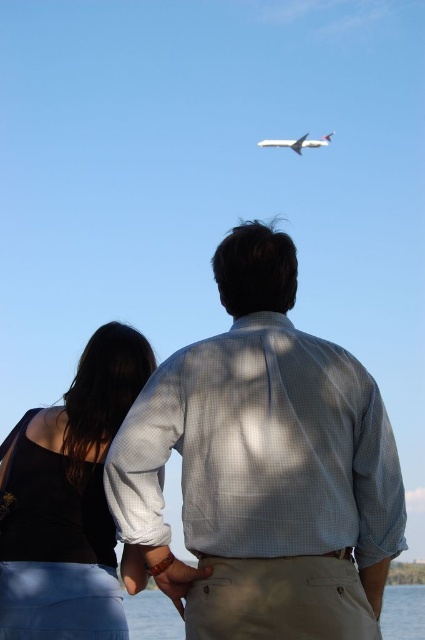
You are a photographer trying to capture a closeup shot of both the white checkered shirt at center and the matte khaki pants at lower center. Given that your camera has a maximum focus range of 8 meters, will you be able to capture both subjects in focus at the same time?

The white checkered shirt at center and matte khaki pants at lower center are 8.22 meters apart. Since the camera can only focus within 8 meters, the distance between them exceeds the maximum focus range. Therefore, you cannot capture both in focus simultaneously.

Based on the scene description, where is the clear water at lower center located in the image?

The clear water at lower center is located at point coordinates of (152, 616).

You are a photographer adjusting your camera settings to capture the scene. You notice the white checkered shirt at center and the matte khaki pants at lower center. Which object should you focus on first if you want to ensure both are in sharp focus, considering their positions?

The white checkered shirt at center is located above matte khaki pants at lower center. To ensure both are in sharp focus, focus on the white checkered shirt at center first as it is closer to the camera, allowing the pants to fall within the depth of field.